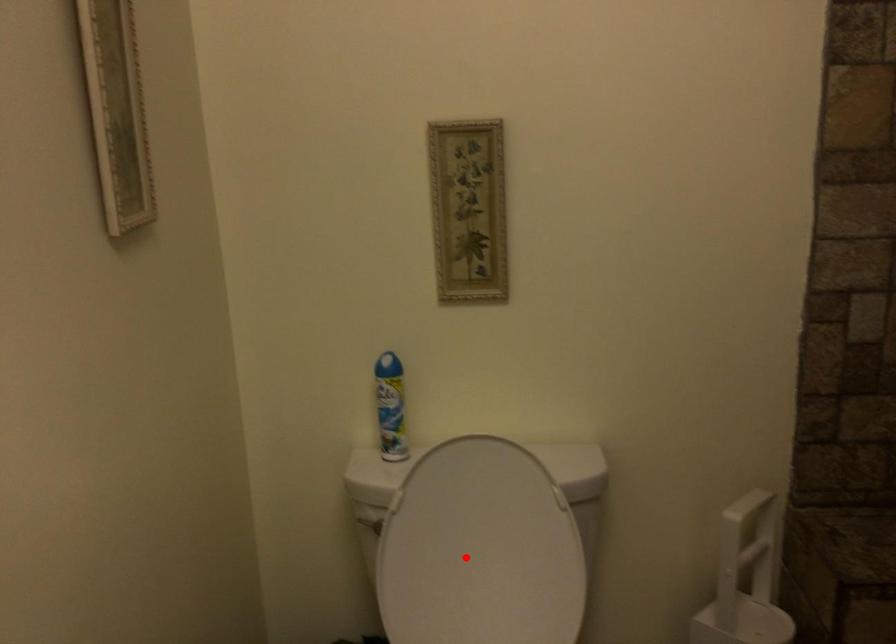
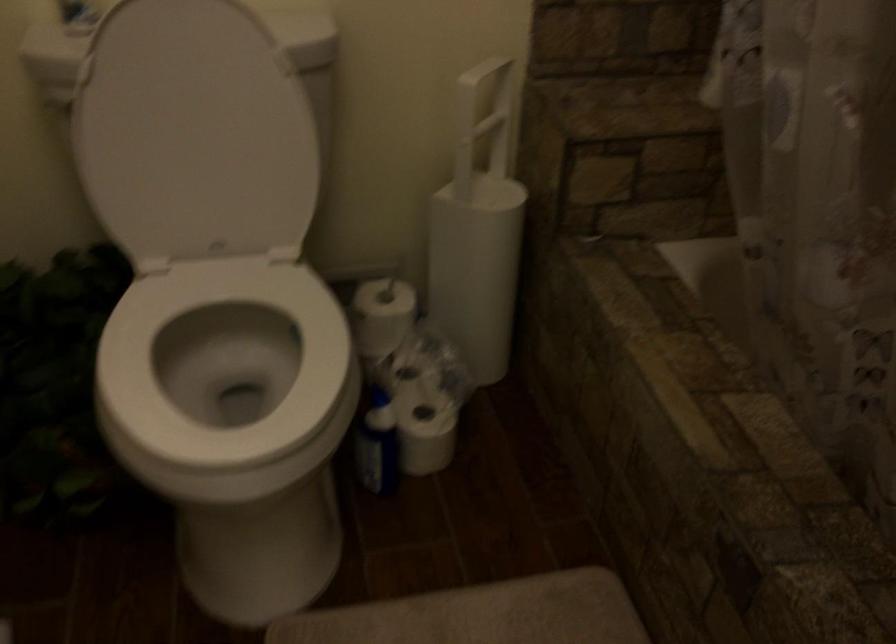
Question: I am providing you with two images of the same scene from different viewpoints. Image1 has a red point marked. In image2, the corresponding 3D location appears at what relative position? Reply with the corresponding letter.

Choices:
 (A) Closer
 (B) Farther

Answer: (A)